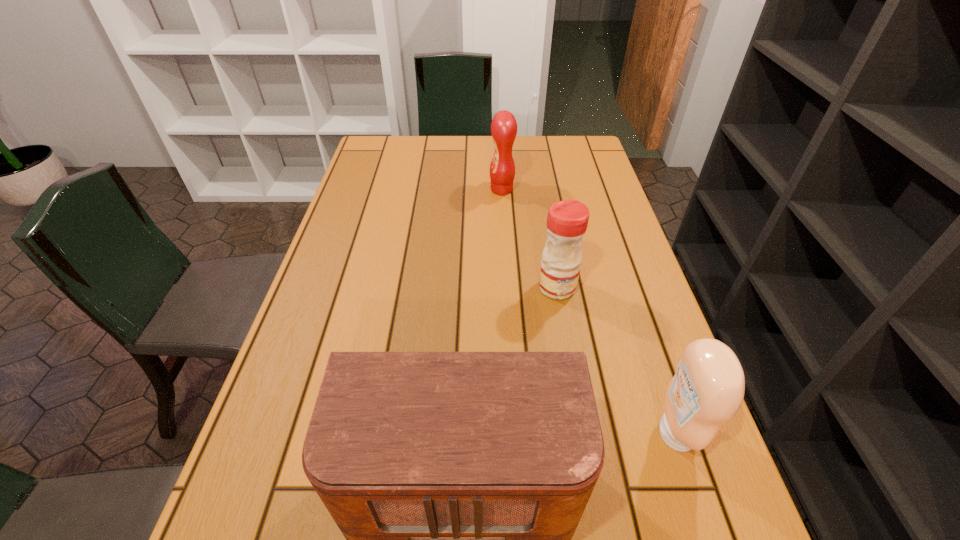
Locate an element on the screen. The height and width of the screenshot is (540, 960). vacant area situated on the label of the nearest condiment is located at coordinates (469, 433).

At what (x,y) coordinates should I click in order to perform the action: click on vacant area situated 0.290m on the label of the nearest condiment. Please return your answer as a coordinate pair (x, y). This screenshot has height=540, width=960. Looking at the image, I should click on (492, 433).

The width and height of the screenshot is (960, 540). I want to click on vacant space situated on the label of the nearest condiment, so click(x=526, y=433).

Locate an element on the screen. object positioned at the right edge is located at coordinates (707, 390).

Locate an element on the screen. free space at the left edge is located at coordinates click(x=384, y=242).

At what (x,y) coordinates should I click in order to perform the action: click on free space at the right edge. Please return your answer as a coordinate pair (x, y). This screenshot has height=540, width=960. Looking at the image, I should click on (629, 273).

You are a GUI agent. You are given a task and a screenshot of the screen. Output one action in this format:
    pyautogui.click(x=<x>, y=<y>)
    Task: Click on the free space at the far right corner of the desktop
    Image resolution: width=960 pixels, height=540 pixels.
    Given the screenshot: What is the action you would take?
    pyautogui.click(x=580, y=169)

The image size is (960, 540). Identify the location of free space between the third nearest object and the farthest condiment. pyautogui.click(x=529, y=239).

Locate an element on the screen. free space between the rightmost object and the farthest object is located at coordinates (588, 312).

Image resolution: width=960 pixels, height=540 pixels. In order to click on free point between the second nearest condiment and the rightmost object in this screenshot , I will do `click(616, 360)`.